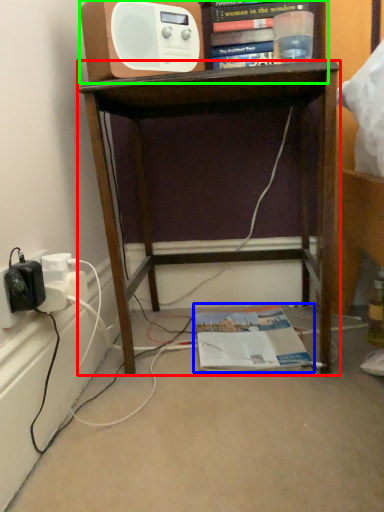
Question: Which is farther away from desk (highlighted by a red box)? magazine (highlighted by a blue box) or shelf (highlighted by a green box)?

Choices:
 (A) magazine
 (B) shelf

Answer: (A)